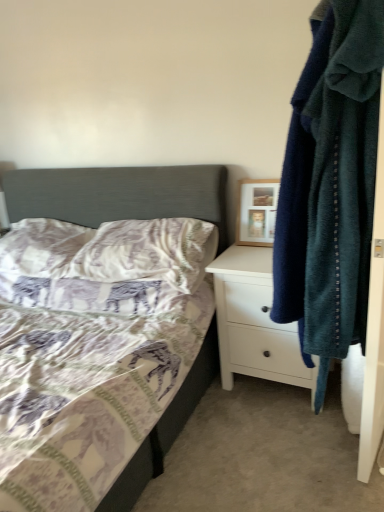
Question: Does white textured pillow at lower left, the first pillow when ordered from left to right, have a lesser height compared to wooden picture frame at upper right?

Choices:
 (A) yes
 (B) no

Answer: (A)

Question: Does white textured pillow at lower left, the first pillow when ordered from left to right, have a smaller size compared to wooden picture frame at upper right?

Choices:
 (A) yes
 (B) no

Answer: (B)

Question: From a real-world perspective, is white textured pillow at lower left, the first pillow when ordered from left to right, physically below wooden picture frame at upper right?

Choices:
 (A) yes
 (B) no

Answer: (A)

Question: Is white textured pillow at lower left, which ranks as the 2th pillow in right-to-left order, located outside wooden picture frame at upper right?

Choices:
 (A) yes
 (B) no

Answer: (A)

Question: Can you confirm if white textured pillow at lower left, the first pillow when ordered from left to right, is thinner than wooden picture frame at upper right?

Choices:
 (A) no
 (B) yes

Answer: (A)

Question: Is white textured pillow at lower left, the first pillow when ordered from left to right, facing towards wooden picture frame at upper right?

Choices:
 (A) no
 (B) yes

Answer: (A)

Question: From a real-world perspective, is patterned fabric bed at center under wooden picture frame at upper right?

Choices:
 (A) yes
 (B) no

Answer: (A)

Question: From a real-world perspective, is patterned fabric bed at center over wooden picture frame at upper right?

Choices:
 (A) yes
 (B) no

Answer: (B)

Question: Is patterned fabric bed at center positioned with its back to wooden picture frame at upper right?

Choices:
 (A) yes
 (B) no

Answer: (B)

Question: Does patterned fabric bed at center have a lesser width compared to wooden picture frame at upper right?

Choices:
 (A) yes
 (B) no

Answer: (B)

Question: Is patterned fabric bed at center not near wooden picture frame at upper right?

Choices:
 (A) no
 (B) yes

Answer: (A)

Question: Is patterned fabric bed at center not within wooden picture frame at upper right?

Choices:
 (A) no
 (B) yes

Answer: (B)

Question: Is the position of wooden picture frame at upper right more distant than that of soft blue towel at right?

Choices:
 (A) yes
 (B) no

Answer: (A)